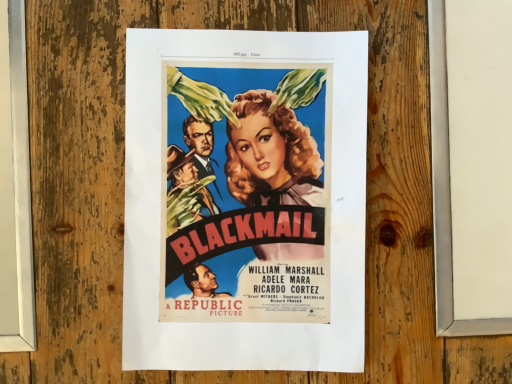
What do you see at coordinates (245, 200) in the screenshot? I see `vivid paper poster at center` at bounding box center [245, 200].

Find the location of a particular element. vivid paper poster at center is located at coordinates (245, 200).

This screenshot has width=512, height=384. What are the coordinates of `vivid paper poster at center` in the screenshot? It's located at (245, 200).